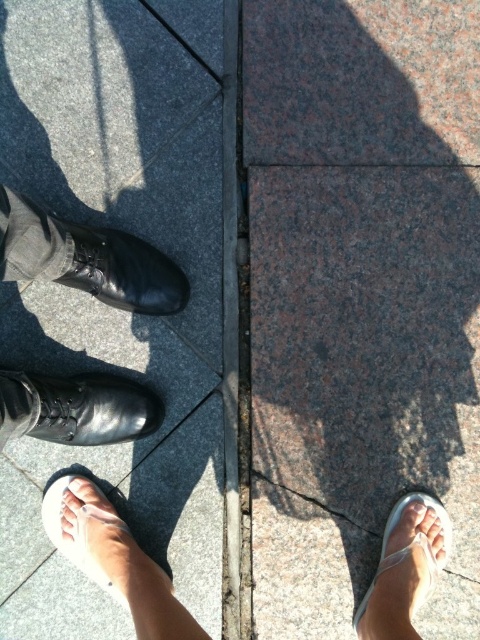
Question: Is shiny black shoes at left above black leather shoe at left?

Choices:
 (A) yes
 (B) no

Answer: (B)

Question: Which point is farther to the camera?

Choices:
 (A) (324, 188)
 (B) (8, 396)

Answer: (A)

Question: In this image, where is gray polished concrete at center located relative to shiny black shoes at left?

Choices:
 (A) below
 (B) above

Answer: (B)

Question: Which object is positioned closest to the white fabric sandal at lower right?

Choices:
 (A) white fabric sandal at lower left
 (B) shiny black shoes at left

Answer: (A)

Question: Is granite at right to the right of shiny black shoes at left from the viewer's perspective?

Choices:
 (A) no
 (B) yes

Answer: (B)

Question: Which of these objects is positioned closest to the granite at right?

Choices:
 (A) shiny black shoes at left
 (B) black leather shoe at left

Answer: (B)